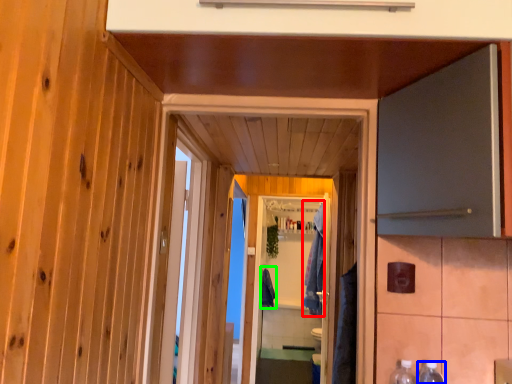
Question: Estimate the real-world distances between objects in this image. Which object is farther from robe (highlighted by a red box), bottle (highlighted by a blue box) or robe (highlighted by a green box)?

Choices:
 (A) bottle
 (B) robe

Answer: (A)